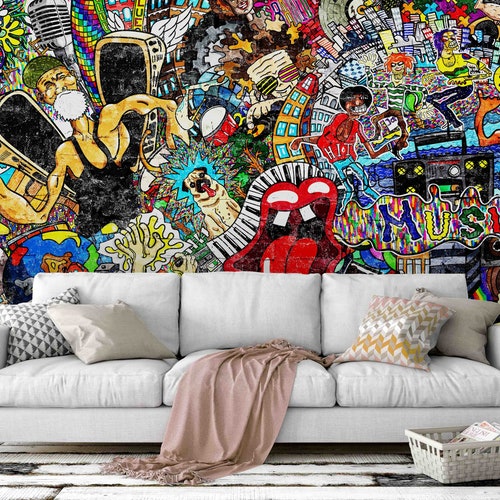
Where is `wall`? Image resolution: width=500 pixels, height=500 pixels. wall is located at coordinates (247, 81).